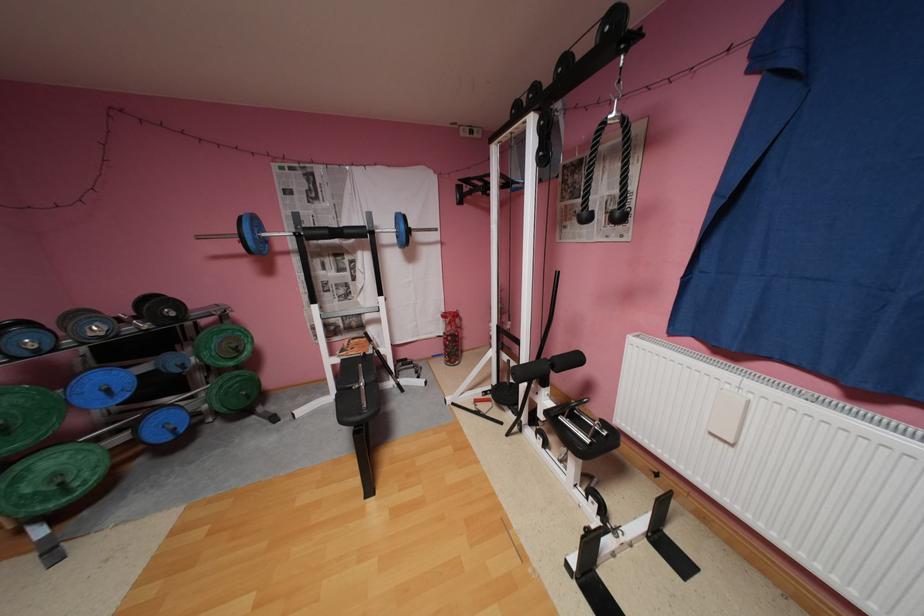
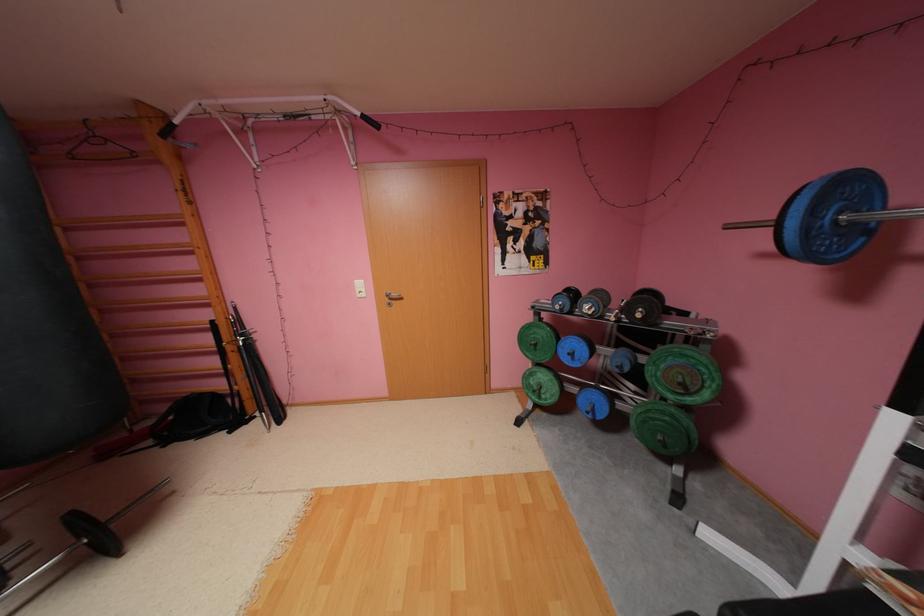
The point at [263,238] is marked in the first image. Where is the corresponding point in the second image?

(816, 229)